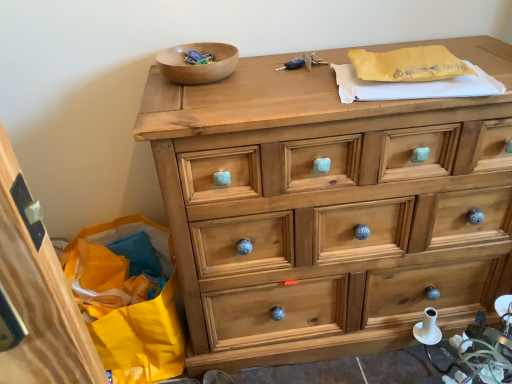
You are a GUI agent. You are given a task and a screenshot of the screen. Output one action in this format:
    pyautogui.click(x=<x>, y=<y>)
    Task: Click on the free spot in front of wooden bowl at upper center
    
    Given the screenshot: What is the action you would take?
    pyautogui.click(x=203, y=99)